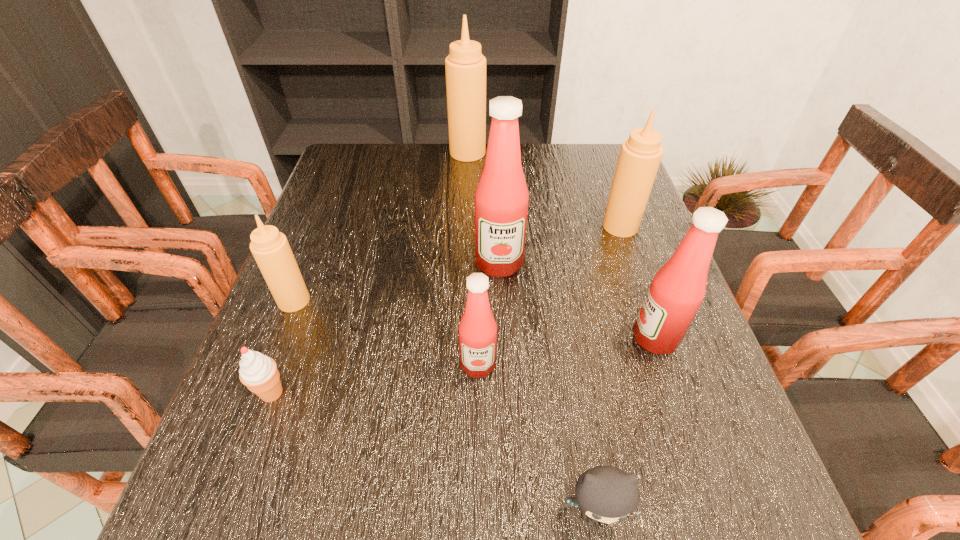
Find the location of `free spot between the farthest red condiment and the seventh nearest object`. free spot between the farthest red condiment and the seventh nearest object is located at coordinates (560, 245).

The height and width of the screenshot is (540, 960). What are the coordinates of `free point between the farthest red condiment and the kitten` in the screenshot? It's located at (547, 388).

Where is `the sixth closest object to the farthest condiment`? the sixth closest object to the farthest condiment is located at coordinates (258, 372).

Choose which object is the seventh nearest neighbor to the second biggest red condiment. Please provide its 2D coordinates. Your answer should be formatted as a tuple, i.e. [(x, y)], where the tuple contains the x and y coordinates of a point satisfying the conditions above.

[(465, 66)]

In order to click on condiment that is the second closest to the red icecream in this screenshot , I will do `click(477, 330)`.

You are a GUI agent. You are given a task and a screenshot of the screen. Output one action in this format:
    pyautogui.click(x=<x>, y=<y>)
    Task: Click on the condiment that can be found as the third closest to the smallest red condiment
    This screenshot has height=540, width=960.
    Given the screenshot: What is the action you would take?
    pyautogui.click(x=270, y=248)

Locate which tan condiment is the second closest to the rightmost tan condiment. Please provide its 2D coordinates. Your answer should be formatted as a tuple, i.e. [(x, y)], where the tuple contains the x and y coordinates of a point satisfying the conditions above.

[(270, 248)]

The image size is (960, 540). I want to click on tan condiment that stands as the second closest to the nearest tan condiment, so click(640, 155).

Select which red condiment is the closest to the smallest red condiment. Please provide its 2D coordinates. Your answer should be formatted as a tuple, i.e. [(x, y)], where the tuple contains the x and y coordinates of a point satisfying the conditions above.

[(501, 199)]

Select which red condiment is the closest to the third object from right to left. Please provide its 2D coordinates. Your answer should be formatted as a tuple, i.e. [(x, y)], where the tuple contains the x and y coordinates of a point satisfying the conditions above.

[(477, 330)]